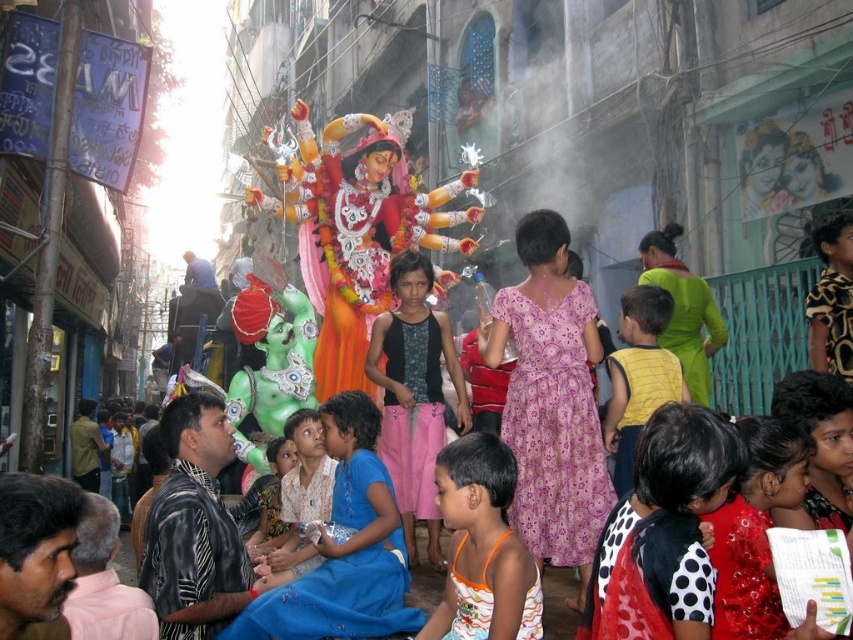
You are a photographer at the festival and want to take a photo of the red satin dress at center. Where should you position yourself to capture the dress in the frame?

The red satin dress at center is located at point (755, 529), so you should position yourself directly in front of that coordinate to capture it in the frame.

You are a photographer standing at the edge of the crowd, wanting to capture a closeup shot of the orange printed tank top at center. Given that your camera has a maximum zoom range of 50 meters, will you be able to take the photo without moving closer?

The orange printed tank top at center is 53.70 meters away from the viewer. Since the camera can only zoom up to 50 meters, you won not be able to capture a clear closeup without moving closer.

You are a photographer at the festival and want to capture both the red satin dress at center and the blue fabric dress at center in the same frame. Since the dresses are at the same location, which dress will appear bigger in the photo?

The red satin dress at center will appear bigger in the photo because it has a larger size compared to the blue fabric dress at center.